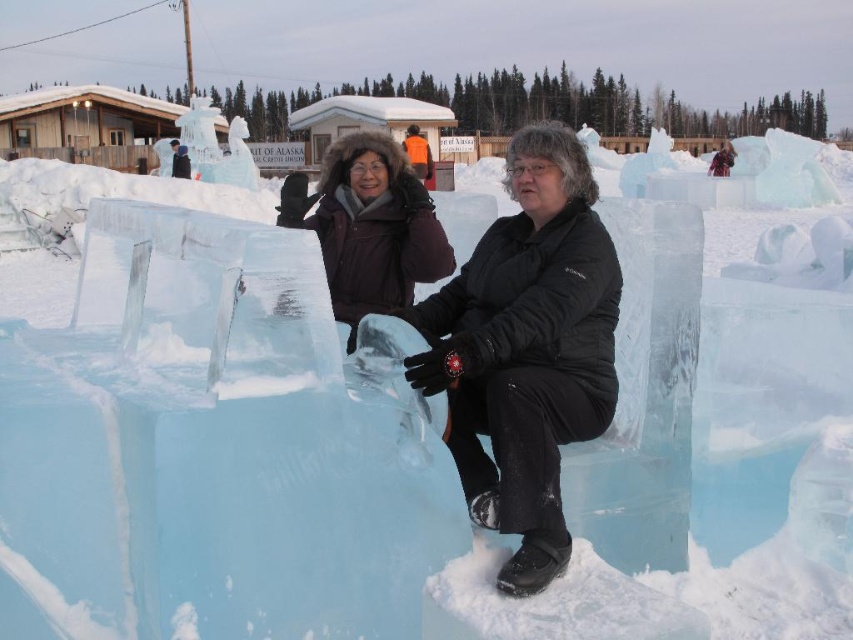
Question: Which object appears farthest from the camera in this image?

Choices:
 (A) matte black jacket at center
 (B) orange fabric jacket at center

Answer: (B)

Question: Which point is closer to the camera?

Choices:
 (A) orange fabric jacket at center
 (B) matte black jacket at center
 (C) transparent ice sculpture at center

Answer: (C)

Question: Can you confirm if transparent ice sculpture at center is positioned below orange fabric jacket at center?

Choices:
 (A) no
 (B) yes

Answer: (B)

Question: Is the position of transparent ice sculpture at center less distant than that of matte black jacket at center?

Choices:
 (A) yes
 (B) no

Answer: (A)

Question: Is matte black jacket at center smaller than orange fabric jacket at center?

Choices:
 (A) yes
 (B) no

Answer: (A)

Question: Considering the real-world distances, which object is farthest from the orange fabric jacket at center?

Choices:
 (A) transparent ice sculpture at center
 (B) matte black jacket at center

Answer: (B)